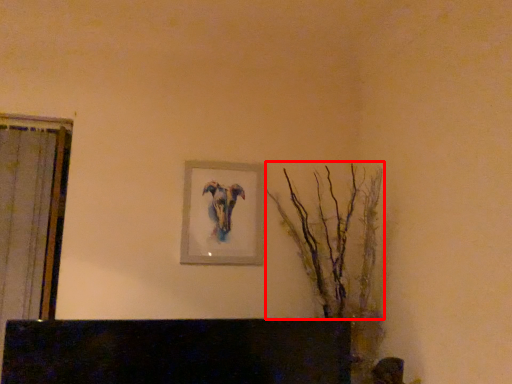
Question: In this image, where is tree (annotated by the red box) located relative to picture frame?

Choices:
 (A) right
 (B) left

Answer: (A)